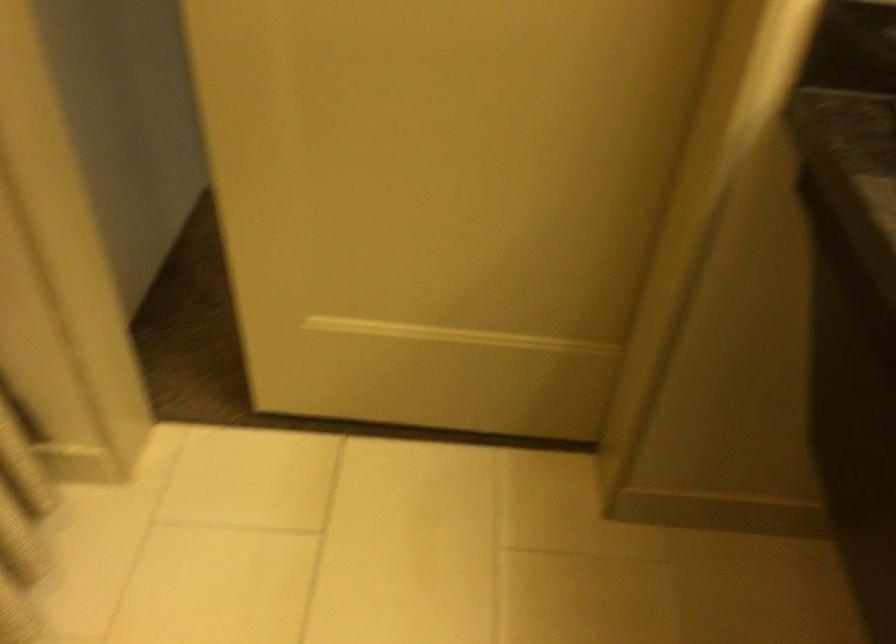
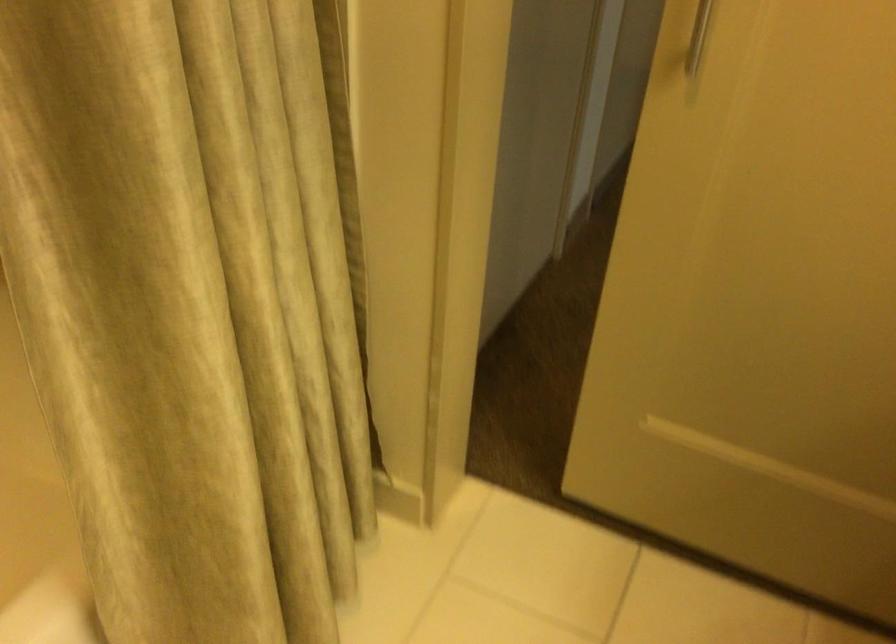
Question: The images are taken continuously from a first-person perspective. In which direction is your viewpoint rotating?

Choices:
 (A) Left
 (B) Right
 (C) Up
 (D) Down

Answer: (A)